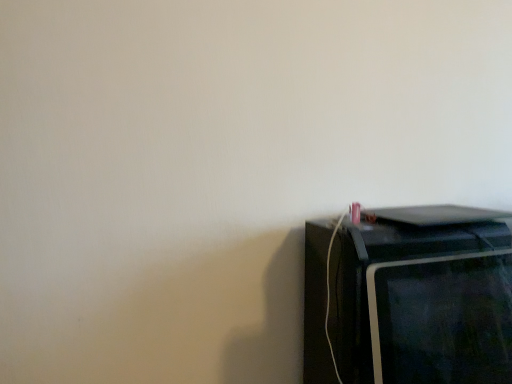
Question: Would you say black glossy microwave at right is to the left or to the right of black glossy monitor at lower right in the picture?

Choices:
 (A) left
 (B) right

Answer: (A)

Question: Looking at their shapes, would you say black glossy microwave at right is wider or thinner than black glossy monitor at lower right?

Choices:
 (A) wide
 (B) thin

Answer: (A)

Question: From a real-world perspective, is black glossy microwave at right physically located above or below black glossy monitor at lower right?

Choices:
 (A) above
 (B) below

Answer: (B)

Question: Looking at their shapes, would you say black glossy monitor at lower right is wider or thinner than black glossy microwave at right?

Choices:
 (A) thin
 (B) wide

Answer: (A)

Question: From a real-world perspective, is black glossy monitor at lower right positioned above or below black glossy microwave at right?

Choices:
 (A) below
 (B) above

Answer: (B)

Question: Would you say black glossy monitor at lower right is inside or outside black glossy microwave at right?

Choices:
 (A) outside
 (B) inside

Answer: (A)

Question: From the image's perspective, is black glossy monitor at lower right above or below black glossy microwave at right?

Choices:
 (A) below
 (B) above

Answer: (B)